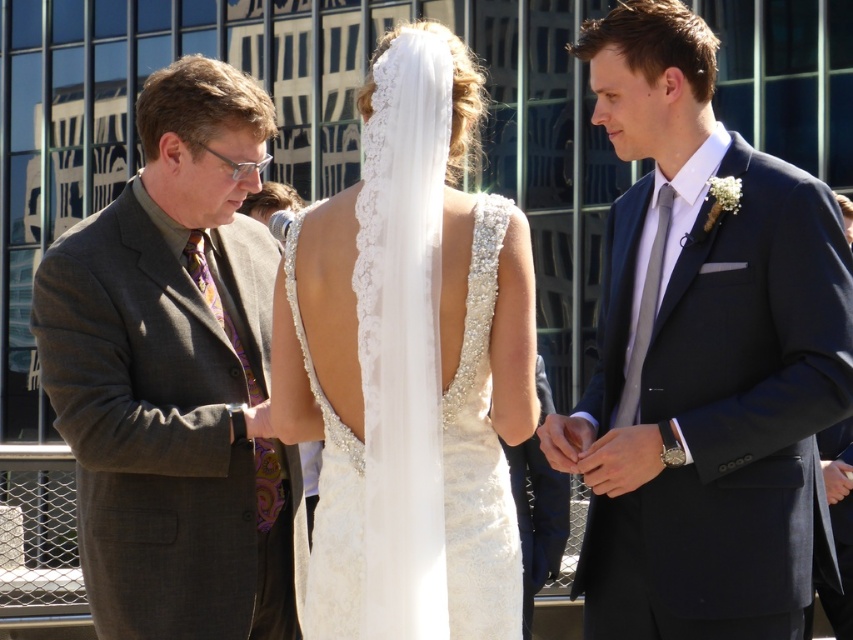
Question: From the image, what is the correct spatial relationship of gray textured suit at left in relation to white lace veil at center?

Choices:
 (A) right
 (B) left

Answer: (B)

Question: Which of these objects is positioned closest to the gray textured suit at left?

Choices:
 (A) navy blue suit at center
 (B) ivory lace dress at center

Answer: (B)

Question: Does ivory lace dress at center appear on the left side of white lace veil at center?

Choices:
 (A) no
 (B) yes

Answer: (B)

Question: Which point is farther from the camera taking this photo?

Choices:
 (A) (380, 544)
 (B) (727, 145)

Answer: (B)

Question: Can you confirm if navy blue suit at center is wider than gray textured suit at left?

Choices:
 (A) no
 (B) yes

Answer: (B)

Question: Which object is farther from the camera taking this photo?

Choices:
 (A) navy blue suit at center
 (B) white lace veil at center

Answer: (A)